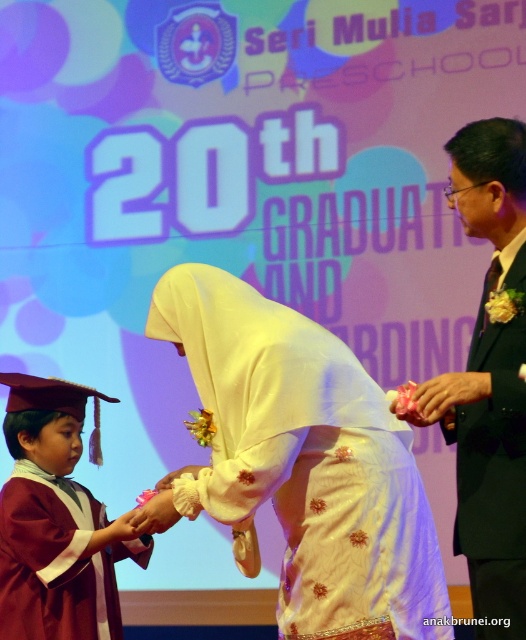
Question: Which object is positioned farthest from the maroon satin graduation gown at lower left?

Choices:
 (A) white satin dress at center
 (B) black suit at right

Answer: (B)

Question: Among these points, which one is nearest to the camera?

Choices:
 (A) (365, 634)
 (B) (512, 500)

Answer: (A)

Question: Is black suit at right closer to camera compared to maroon satin graduation gown at lower left?

Choices:
 (A) yes
 (B) no

Answer: (A)

Question: Considering the real-world distances, which object is closest to the maroon satin graduation gown at lower left?

Choices:
 (A) white satin dress at center
 (B) black suit at right

Answer: (A)

Question: Is black suit at right above maroon satin graduation gown at lower left?

Choices:
 (A) no
 (B) yes

Answer: (B)

Question: Is black suit at right positioned at the back of maroon satin graduation gown at lower left?

Choices:
 (A) yes
 (B) no

Answer: (B)